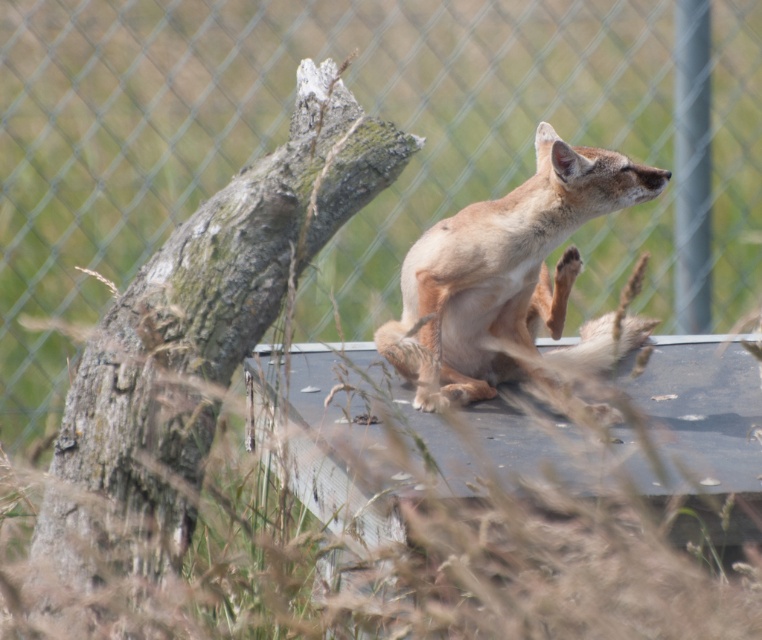
Does green mossy tree trunk at center appear on the left side of light brown fur fox at center?

Indeed, green mossy tree trunk at center is positioned on the left side of light brown fur fox at center.

Which is behind, point (117, 570) or point (436, 314)?

The point (436, 314) is behind.

What do you see at coordinates (186, 369) in the screenshot? Image resolution: width=762 pixels, height=640 pixels. I see `green mossy tree trunk at center` at bounding box center [186, 369].

Locate an element on the screen. This screenshot has height=640, width=762. green mossy tree trunk at center is located at coordinates (186, 369).

Who is higher up, metallic chain-link fence at upper center or light brown fur fox at center?

metallic chain-link fence at upper center is higher up.

Where is `metallic chain-link fence at upper center`? metallic chain-link fence at upper center is located at coordinates (279, 138).

The height and width of the screenshot is (640, 762). Identify the location of metallic chain-link fence at upper center. (279, 138).

Who is shorter, metallic chain-link fence at upper center or green mossy tree trunk at center?

Standing shorter between the two is green mossy tree trunk at center.

Which is below, metallic chain-link fence at upper center or green mossy tree trunk at center?

green mossy tree trunk at center is below.

Is point (498, 17) positioned in front of point (200, 227)?

No, (498, 17) is behind (200, 227).

Find the location of a particular element. metallic chain-link fence at upper center is located at coordinates (279, 138).